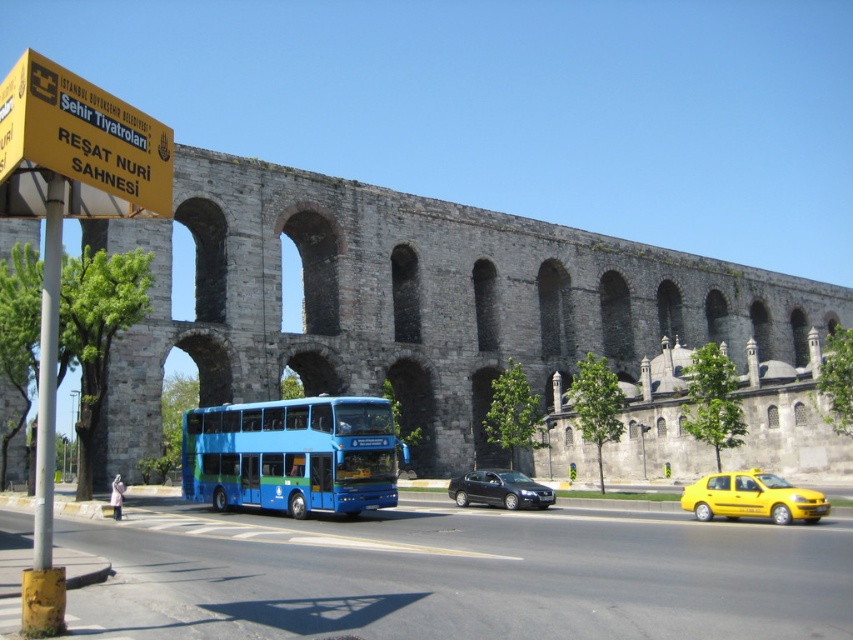
Does yellow plastic sign at upper left appear on the right side of yellow matte taxi at lower right?

Incorrect, yellow plastic sign at upper left is not on the right side of yellow matte taxi at lower right.

Based on the photo, how distant is yellow plastic sign at upper left from yellow matte taxi at lower right?

The distance of yellow plastic sign at upper left from yellow matte taxi at lower right is 30.04 meters.

The height and width of the screenshot is (640, 853). I want to click on yellow plastic sign at upper left, so click(x=78, y=147).

Image resolution: width=853 pixels, height=640 pixels. In order to click on yellow plastic sign at upper left in this screenshot , I will do `click(78, 147)`.

Can you confirm if yellow matte taxi at lower right is taller than shiny black sedan at center?

No, yellow matte taxi at lower right is not taller than shiny black sedan at center.

Between yellow matte taxi at lower right and shiny black sedan at center, which one appears on the right side from the viewer's perspective?

From the viewer's perspective, yellow matte taxi at lower right appears more on the right side.

The width and height of the screenshot is (853, 640). In order to click on yellow matte taxi at lower right in this screenshot , I will do `click(752, 497)`.

Where is `blue metallic bus at center`? Image resolution: width=853 pixels, height=640 pixels. blue metallic bus at center is located at coordinates (292, 454).

Between blue metallic bus at center and yellow plastic sign at upper left, which one appears on the left side from the viewer's perspective?

Positioned to the left is blue metallic bus at center.

Who is more distant from viewer, (393, 468) or (138, 148)?

The point (393, 468) is behind.

At what (x,y) coordinates should I click in order to perform the action: click on blue metallic bus at center. Please return your answer as a coordinate pair (x, y). Image resolution: width=853 pixels, height=640 pixels. Looking at the image, I should click on (292, 454).